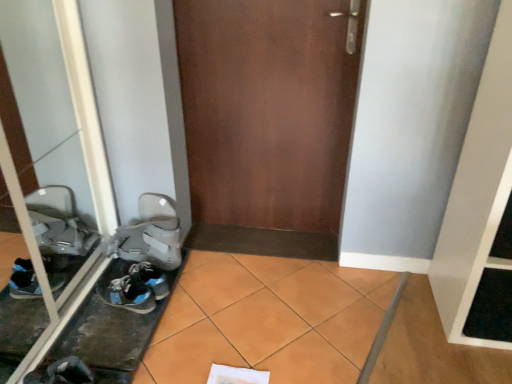
In order to click on vacant space to the left of blue synthetic sneakers at lower left, acting as the second footwear starting from the top in this screenshot , I will do `click(93, 312)`.